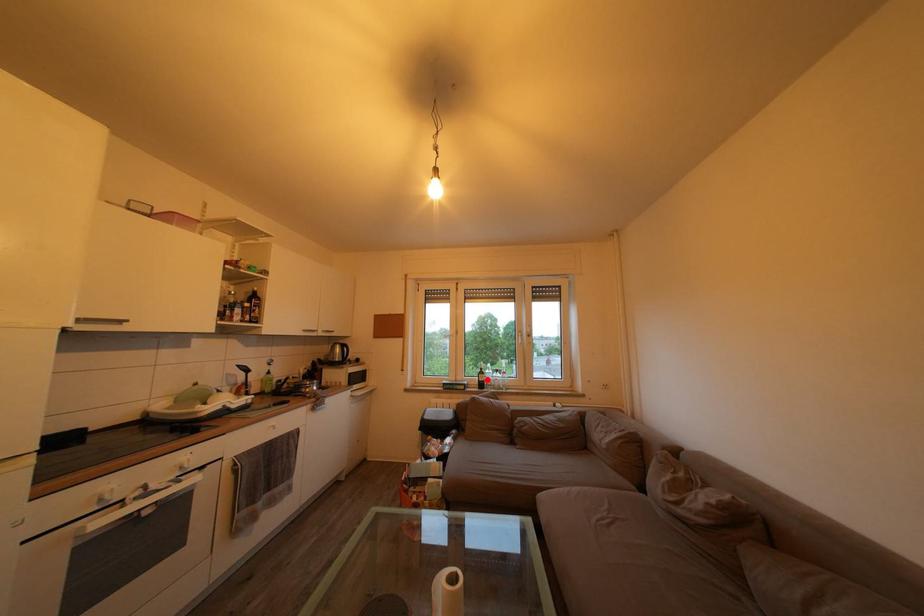
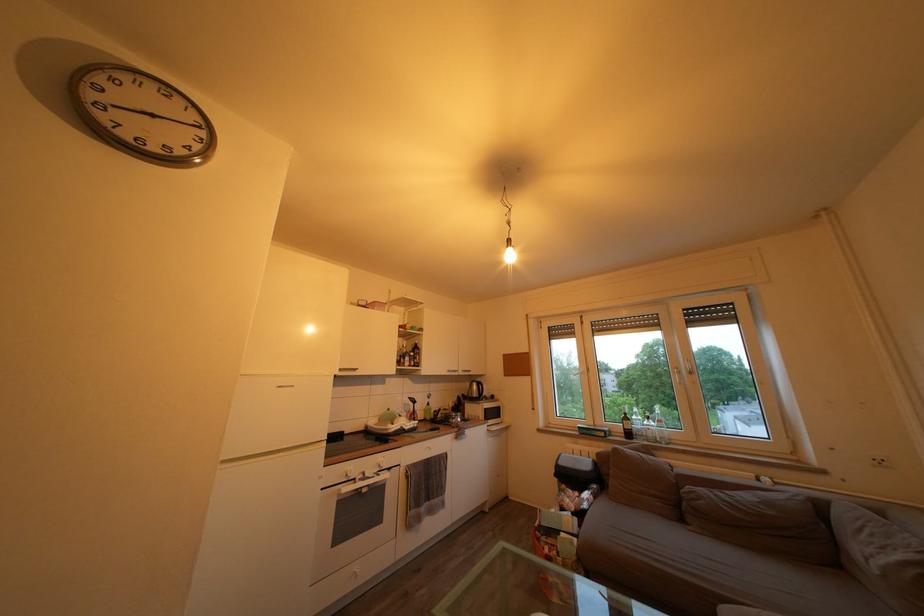
Question: I am providing you with two images of the same scene from different viewpoints. A red point is shown in image1. For the corresponding object point in image2, is it positioned nearer or farther from the camera?

Choices:
 (A) Nearer
 (B) Farther

Answer: (A)